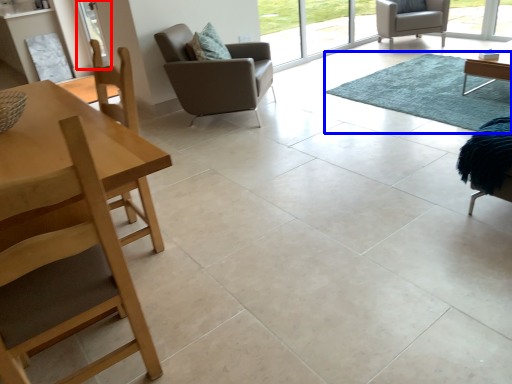
Question: Which point is closer to the camera, screen door (highlighted by a red box) or mat (highlighted by a blue box)?

Choices:
 (A) screen door
 (B) mat

Answer: (B)